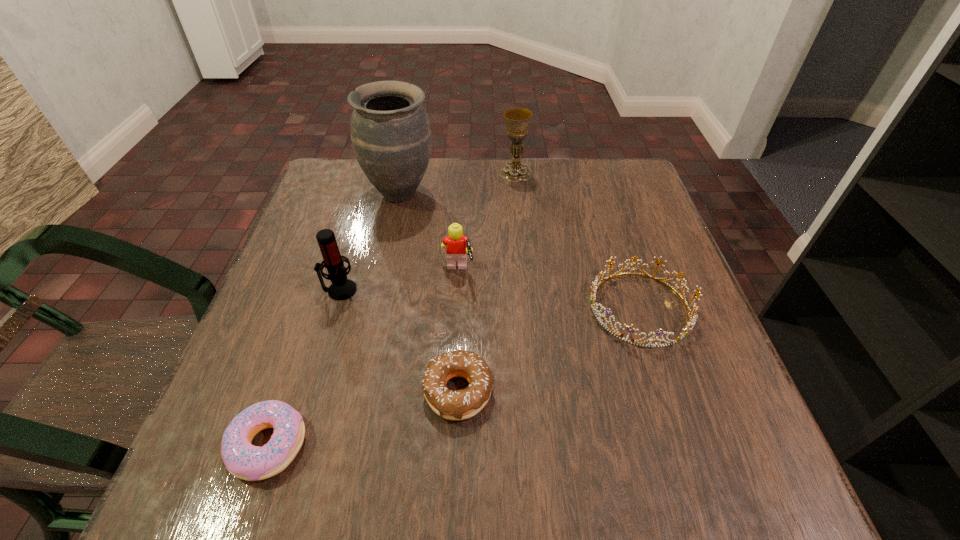
Find the location of a particular element. This screenshot has height=540, width=960. vacant space at the near right corner of the desktop is located at coordinates coord(747,484).

Identify the location of free space between the Lego and the left doughnut. The width and height of the screenshot is (960, 540). (363, 359).

The width and height of the screenshot is (960, 540). Identify the location of vacant area between the microphone and the rightmost object. (490, 299).

The image size is (960, 540). In order to click on unoccupied area between the tiara and the right doughnut in this screenshot , I will do click(x=549, y=349).

The image size is (960, 540). I want to click on free space between the urn and the right doughnut, so click(429, 292).

This screenshot has height=540, width=960. I want to click on vacant space that's between the tallest object and the microphone, so click(370, 241).

Where is `vacant area that lies between the Lego and the microphone`? The height and width of the screenshot is (540, 960). vacant area that lies between the Lego and the microphone is located at coordinates (398, 281).

Identify the location of empty space between the fourth shortest object and the second object from right to left. (487, 222).

You are a GUI agent. You are given a task and a screenshot of the screen. Output one action in this format:
    pyautogui.click(x=<x>, y=<y>)
    Task: Click on the free space that is in between the Lego and the left doughnut
    The image size is (960, 540).
    Given the screenshot: What is the action you would take?
    (363, 359)

The width and height of the screenshot is (960, 540). Find the location of `free space between the right doughnut and the left doughnut`. free space between the right doughnut and the left doughnut is located at coordinates (364, 418).